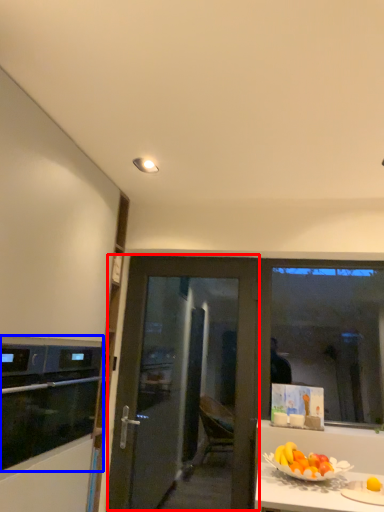
Question: Among these objects, which one is nearest to the camera, door (highlighted by a red box) or kitchen appliance (highlighted by a blue box)?

Choices:
 (A) door
 (B) kitchen appliance

Answer: (B)